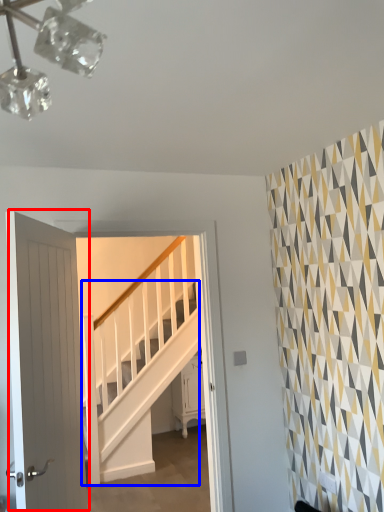
Question: Which of the following is the farthest to the observer, door (highlighted by a red box) or stairs (highlighted by a blue box)?

Choices:
 (A) door
 (B) stairs

Answer: (B)